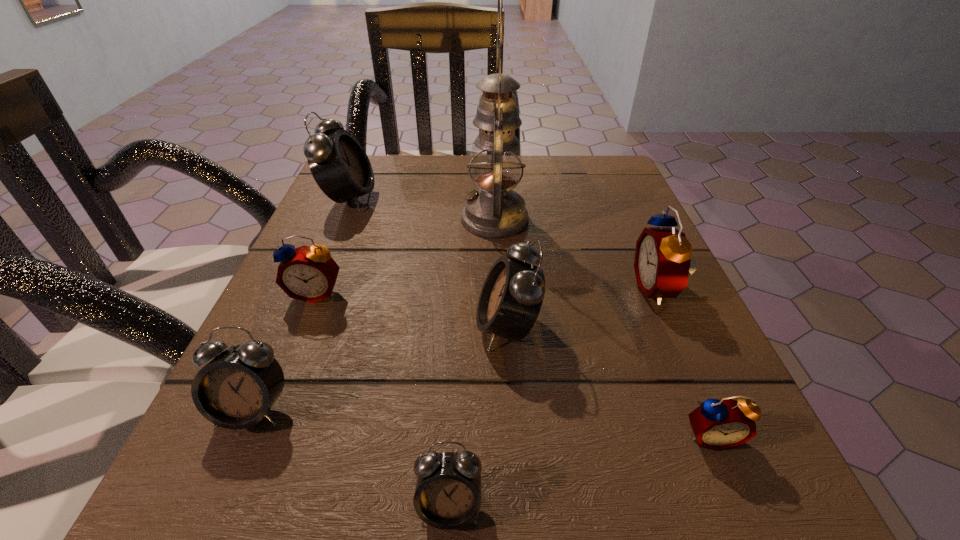
In order to click on the nearest alarm clock in this screenshot , I will do `click(448, 494)`.

Identify the location of vacant region located on the right of the tallest object. (644, 219).

The height and width of the screenshot is (540, 960). Find the location of `free space located on the face of the farthest alarm clock`. free space located on the face of the farthest alarm clock is located at coordinates (521, 199).

The height and width of the screenshot is (540, 960). Find the location of `vacant point located 0.230m on the front-facing side of the biggest red alarm clock`. vacant point located 0.230m on the front-facing side of the biggest red alarm clock is located at coordinates (496, 289).

I want to click on vacant space located on the front-facing side of the biggest red alarm clock, so click(429, 289).

Identify the location of vacant region located on the front-facing side of the biggest red alarm clock. (576, 289).

The height and width of the screenshot is (540, 960). Find the location of `vacant space located on the face of the third smallest white alarm clock`. vacant space located on the face of the third smallest white alarm clock is located at coordinates (276, 328).

Identify the location of vacant region located on the face of the third smallest white alarm clock. (396, 328).

Locate an element on the screen. The height and width of the screenshot is (540, 960). vacant space located on the face of the third smallest white alarm clock is located at coordinates (389, 328).

This screenshot has height=540, width=960. I want to click on free space located 0.280m on the front-facing side of the leftmost red alarm clock, so click(x=239, y=483).